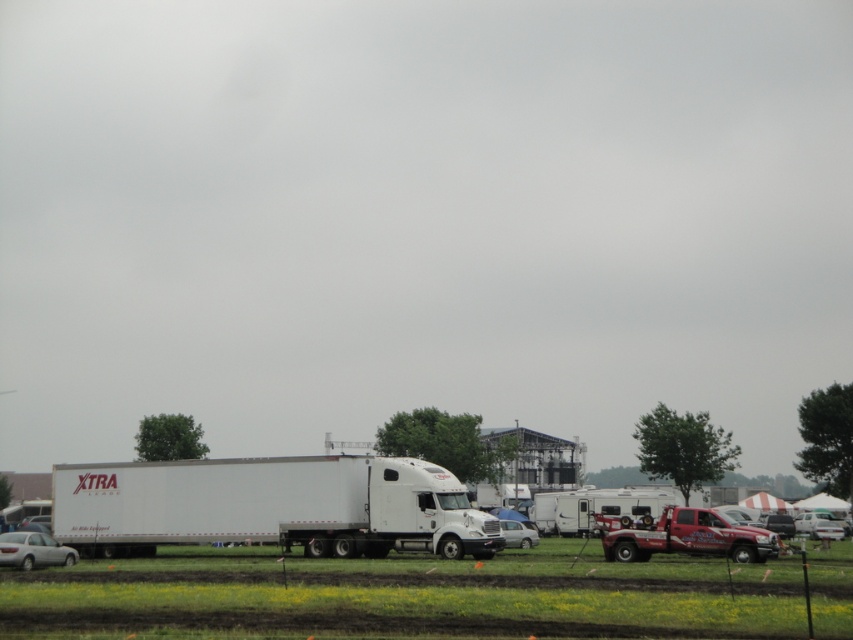
You are a driver who needs to park your car between the red matte truck at lower right and the white glossy car at center. Is there enough space for your car which is 5 meters long?

The red matte truck at lower right is to the right of the white glossy car at center, but the distance between them isn t specified in the objects description. Without knowing the exact spacing, it s impossible to determine if there s enough room for a 5 meter car.

You are a photographer setting up a tripod to take a picture of the white glossy car at lower right and the white glossy car at center. Which car should you position your tripod closer to if you want both cars to be in focus without adjusting the lens settings?

The white glossy car at lower right is below the white glossy car at center. To keep both in focus, position the tripod closer to the white glossy car at lower right since it is farther away and requires a smaller aperture or greater depth of field to capture both distances effectively.

You are a delivery driver who needs to park your vehicle between the red matte truck at lower right and the white glossy car at center. Based on their widths, can you safely park your vehicle without touching either of them?

The red matte truck at lower right might be wider than white glossy car at center, so there might not be enough space to park safely between them. It is recommended to choose another spot.